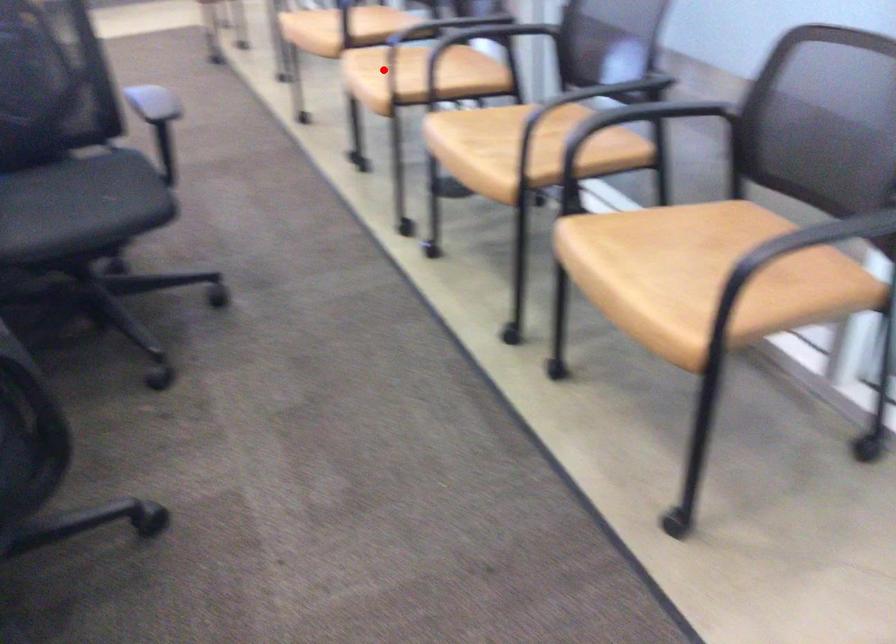
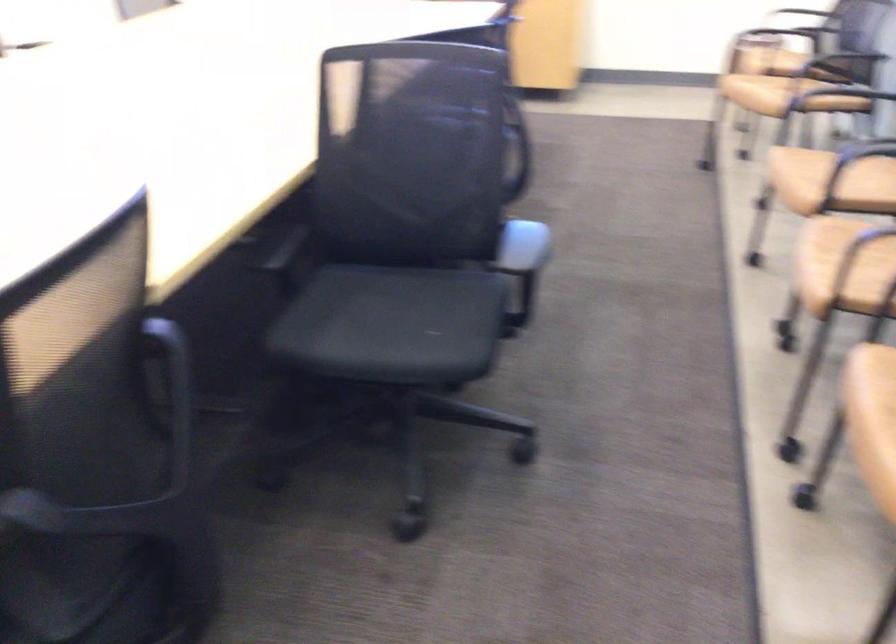
Find the pixel in the second image that matches the highlighted location in the first image.

(842, 242)